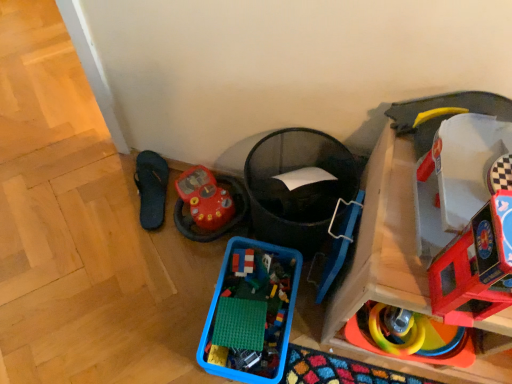
Find the location of a particular element. This screenshot has height=384, width=512. wooden toy car at right, the 6th toy in the left-to-right sequence is located at coordinates (396, 216).

What are the coordinates of `black rubber flip-flop at lower left` in the screenshot? It's located at (151, 188).

Is wooden toy car at right, the 6th toy in the left-to-right sequence, oriented towards smooth plastic toy car at right, arranged as the second toy when viewed from the right?

No, wooden toy car at right, the 6th toy in the left-to-right sequence, is not facing towards smooth plastic toy car at right, arranged as the second toy when viewed from the right.

Is wooden toy car at right, the 6th toy in the left-to-right sequence, inside the boundaries of smooth plastic toy car at right, the fifth toy viewed from the left, or outside?

wooden toy car at right, the 6th toy in the left-to-right sequence, is not inside smooth plastic toy car at right, the fifth toy viewed from the left, it's outside.

Considering the relative positions of wooden toy car at right, the first toy viewed from the right, and smooth plastic toy car at right, arranged as the second toy when viewed from the right, in the image provided, is wooden toy car at right, the first toy viewed from the right, to the left or to the right of smooth plastic toy car at right, arranged as the second toy when viewed from the right,?

wooden toy car at right, the first toy viewed from the right, is positioned on smooth plastic toy car at right, arranged as the second toy when viewed from the right,'s right side.

Is rubberized plastic rings at lower right, marked as the fourth toy in a left-to-right arrangement, directly adjacent to rubberized plastic toy car at lower left, positioned as the 6th toy in right-to-left order?

No, rubberized plastic rings at lower right, marked as the fourth toy in a left-to-right arrangement, is not next to rubberized plastic toy car at lower left, positioned as the 6th toy in right-to-left order.

In the scene shown: How different are the orientations of rubberized plastic rings at lower right, marked as the 3th toy in a right-to-left arrangement, and rubberized plastic toy car at lower left, positioned as the 6th toy in right-to-left order, in degrees?

55.6 degrees.

Based on the photo, between rubberized plastic rings at lower right, marked as the 3th toy in a right-to-left arrangement, and rubberized plastic toy car at lower left, positioned as the 6th toy in right-to-left order, which one has more height?

rubberized plastic toy car at lower left, positioned as the 6th toy in right-to-left order, is taller.

From a real-world perspective, which is physically below, rubberized plastic rings at lower right, marked as the fourth toy in a left-to-right arrangement, or rubberized plastic toy car at lower left, which is the first toy in left-to-right order?

In real-world perspective, rubberized plastic toy car at lower left, which is the first toy in left-to-right order, is lower.

Between black rubber flip-flop at lower left and translucent plastic bricks at center, which is counted as the fifth toy, starting from the right, which one appears on the right side from the viewer's perspective?

translucent plastic bricks at center, which is counted as the fifth toy, starting from the right, is more to the right.

From the image's perspective, is black rubber flip-flop at lower left beneath translucent plastic bricks at center, the second toy from the left?

No, from the image's perspective, black rubber flip-flop at lower left is not below translucent plastic bricks at center, the second toy from the left.

Considering their positions, is black rubber flip-flop at lower left located in front of or behind translucent plastic bricks at center, the second toy from the left?

Clearly, black rubber flip-flop at lower left is behind translucent plastic bricks at center, the second toy from the left.

Based on the photo, how far apart are blue plastic container at lower center, placed as the 4th toy when sorted from right to left, and rubberized plastic toy car at lower left, which is the first toy in left-to-right order?

blue plastic container at lower center, placed as the 4th toy when sorted from right to left, is 9.27 inches away from rubberized plastic toy car at lower left, which is the first toy in left-to-right order.

Can we say blue plastic container at lower center, which is the third toy from left to right, lies outside rubberized plastic toy car at lower left, positioned as the 6th toy in right-to-left order?

blue plastic container at lower center, which is the third toy from left to right, lies outside rubberized plastic toy car at lower left, positioned as the 6th toy in right-to-left order,'s area.

Can you confirm if blue plastic container at lower center, which is the third toy from left to right, is taller than rubberized plastic toy car at lower left, which is the first toy in left-to-right order?

Yes, blue plastic container at lower center, which is the third toy from left to right, is taller than rubberized plastic toy car at lower left, which is the first toy in left-to-right order.

Which of these two, blue plastic container at lower center, which is the third toy from left to right, or rubberized plastic toy car at lower left, positioned as the 6th toy in right-to-left order, is smaller?

rubberized plastic toy car at lower left, positioned as the 6th toy in right-to-left order.

Based on the photo, is smooth plastic toy car at right, arranged as the second toy when viewed from the right, not near rubberized plastic toy car at lower left, which is the first toy in left-to-right order?

No, there isn't a large distance between smooth plastic toy car at right, arranged as the second toy when viewed from the right, and rubberized plastic toy car at lower left, which is the first toy in left-to-right order.

Looking at their sizes, would you say smooth plastic toy car at right, arranged as the second toy when viewed from the right, is wider or thinner than rubberized plastic toy car at lower left, positioned as the 6th toy in right-to-left order?

smooth plastic toy car at right, arranged as the second toy when viewed from the right, is thinner than rubberized plastic toy car at lower left, positioned as the 6th toy in right-to-left order.

Between smooth plastic toy car at right, arranged as the second toy when viewed from the right, and rubberized plastic toy car at lower left, which is the first toy in left-to-right order, which one has more height?

Standing taller between the two is smooth plastic toy car at right, arranged as the second toy when viewed from the right.

Identify the location of the 5th toy behind the smooth plastic toy car at right, arranged as the second toy when viewed from the right. The image size is (512, 384). (208, 204).

From the image's perspective, does smooth plastic toy car at right, arranged as the second toy when viewed from the right, appear lower than blue plastic container at lower center, which is the third toy from left to right?

Incorrect, from the image's perspective, smooth plastic toy car at right, arranged as the second toy when viewed from the right, is higher than blue plastic container at lower center, which is the third toy from left to right.

Based on their positions, is smooth plastic toy car at right, the fifth toy viewed from the left, located to the left or right of blue plastic container at lower center, which is the third toy from left to right?

smooth plastic toy car at right, the fifth toy viewed from the left, is positioned on blue plastic container at lower center, which is the third toy from left to right,'s right side.

Considering the sizes of smooth plastic toy car at right, the fifth toy viewed from the left, and blue plastic container at lower center, placed as the 4th toy when sorted from right to left, in the image, is smooth plastic toy car at right, the fifth toy viewed from the left, bigger or smaller than blue plastic container at lower center, placed as the 4th toy when sorted from right to left,?

smooth plastic toy car at right, the fifth toy viewed from the left, is smaller than blue plastic container at lower center, placed as the 4th toy when sorted from right to left.

From the picture: Can blue plastic container at lower center, placed as the 4th toy when sorted from right to left, be found inside smooth plastic toy car at right, arranged as the second toy when viewed from the right?

That's incorrect, blue plastic container at lower center, placed as the 4th toy when sorted from right to left, is not inside smooth plastic toy car at right, arranged as the second toy when viewed from the right.

Between rubberized plastic toy car at lower left, positioned as the 6th toy in right-to-left order, and black rubber flip-flop at lower left, which one appears on the left side from the viewer's perspective?

From the viewer's perspective, black rubber flip-flop at lower left appears more on the left side.

Is rubberized plastic toy car at lower left, which is the first toy in left-to-right order, next to black rubber flip-flop at lower left?

No.

Does rubberized plastic toy car at lower left, positioned as the 6th toy in right-to-left order, have a greater width compared to black rubber flip-flop at lower left?

In fact, rubberized plastic toy car at lower left, positioned as the 6th toy in right-to-left order, might be narrower than black rubber flip-flop at lower left.

From the image's perspective, is rubberized plastic toy car at lower left, positioned as the 6th toy in right-to-left order, located above or below black rubber flip-flop at lower left?

From the image's perspective, rubberized plastic toy car at lower left, positioned as the 6th toy in right-to-left order, appears below black rubber flip-flop at lower left.

This screenshot has width=512, height=384. I want to click on toy on the right of smooth plastic toy car at right, the fifth toy viewed from the left, so click(396, 216).

The width and height of the screenshot is (512, 384). In order to click on the 3rd toy in front of the rubberized plastic toy car at lower left, which is the first toy in left-to-right order, starting your count from the anchor in this screenshot , I will do `click(411, 338)`.

Based on their spatial positions, is wooden toy car at right, the first toy viewed from the right, or rubberized plastic toy car at lower left, which is the first toy in left-to-right order, closer to rubberized plastic rings at lower right, marked as the fourth toy in a left-to-right arrangement?

wooden toy car at right, the first toy viewed from the right, lies closer to rubberized plastic rings at lower right, marked as the fourth toy in a left-to-right arrangement, than the other object.

From the image, which object appears to be farther from blue plastic container at lower center, placed as the 4th toy when sorted from right to left, smooth plastic toy car at right, arranged as the second toy when viewed from the right, or rubberized plastic rings at lower right, marked as the 3th toy in a right-to-left arrangement?

smooth plastic toy car at right, arranged as the second toy when viewed from the right, is positioned further to the anchor blue plastic container at lower center, placed as the 4th toy when sorted from right to left.

From the picture: From the image, which object appears to be farther from black rubber flip-flop at lower left, smooth plastic toy car at right, the fifth toy viewed from the left, or translucent plastic bricks at center, which is counted as the fifth toy, starting from the right?

Among the two, smooth plastic toy car at right, the fifth toy viewed from the left, is located further to black rubber flip-flop at lower left.

When comparing their distances from rubberized plastic rings at lower right, marked as the fourth toy in a left-to-right arrangement, does translucent plastic bricks at center, which is counted as the fifth toy, starting from the right, or blue plastic container at lower center, placed as the 4th toy when sorted from right to left, seem closer?

Based on the image, blue plastic container at lower center, placed as the 4th toy when sorted from right to left, appears to be nearer to rubberized plastic rings at lower right, marked as the fourth toy in a left-to-right arrangement.

Which object lies nearer to the anchor point blue plastic container at lower center, placed as the 4th toy when sorted from right to left, black rubber flip-flop at lower left or rubberized plastic rings at lower right, marked as the 3th toy in a right-to-left arrangement?

The object closer to blue plastic container at lower center, placed as the 4th toy when sorted from right to left, is rubberized plastic rings at lower right, marked as the 3th toy in a right-to-left arrangement.

From the image, which object appears to be farther from black rubber flip-flop at lower left, rubberized plastic rings at lower right, marked as the fourth toy in a left-to-right arrangement, or wooden toy car at right, the first toy viewed from the right?

rubberized plastic rings at lower right, marked as the fourth toy in a left-to-right arrangement, is further to black rubber flip-flop at lower left.

Estimate the real-world distances between objects in this image. Which object is further from blue plastic container at lower center, placed as the 4th toy when sorted from right to left, rubberized plastic rings at lower right, marked as the fourth toy in a left-to-right arrangement, or translucent plastic bricks at center, which is counted as the fifth toy, starting from the right?

Among the two, rubberized plastic rings at lower right, marked as the fourth toy in a left-to-right arrangement, is located further to blue plastic container at lower center, placed as the 4th toy when sorted from right to left.

Based on the photo, based on their spatial positions, is rubberized plastic rings at lower right, marked as the fourth toy in a left-to-right arrangement, or smooth plastic toy car at right, the fifth toy viewed from the left, further from translucent plastic bricks at center, which is counted as the fifth toy, starting from the right?

smooth plastic toy car at right, the fifth toy viewed from the left, is positioned further to the anchor translucent plastic bricks at center, which is counted as the fifth toy, starting from the right.

I want to click on toy situated between black rubber flip-flop at lower left and translucent plastic bricks at center, the second toy from the left, from left to right, so click(208, 204).

This screenshot has height=384, width=512. What are the coordinates of `toy situated between translucent plastic bricks at center, the second toy from the left, and rubberized plastic rings at lower right, marked as the 3th toy in a right-to-left arrangement, from left to right` in the screenshot? It's located at (217, 304).

Find the location of a particular element. The image size is (512, 384). toy positioned between smooth plastic toy car at right, the fifth toy viewed from the left, and rubberized plastic rings at lower right, marked as the 3th toy in a right-to-left arrangement, from near to far is located at coordinates (396, 216).